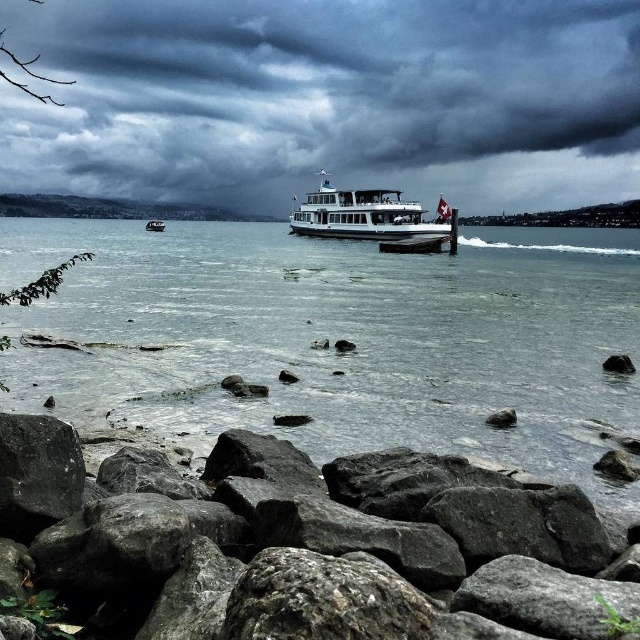
Which is in front, point (51, 45) or point (152, 227)?

Point (152, 227) is more forward.

Is dark gray cloudy sky at upper center thinner than wooden boat at center?

In fact, dark gray cloudy sky at upper center might be wider than wooden boat at center.

Which is in front, point (417, 60) or point (161, 221)?

Point (161, 221) is more forward.

In order to click on dark gray cloudy sky at upper center in this screenshot , I will do `click(328, 99)`.

Between gray rock at lower left and wooden boat at center, which one appears on the left side from the viewer's perspective?

wooden boat at center is more to the left.

The image size is (640, 640). Describe the element at coordinates (307, 547) in the screenshot. I see `gray rock at lower left` at that location.

Locate an element on the screen. This screenshot has height=640, width=640. gray rock at lower left is located at coordinates (307, 547).

Between dark gray cloudy sky at upper center and white glossy ferry at center, which one has more height?

With more height is dark gray cloudy sky at upper center.

Can you confirm if dark gray cloudy sky at upper center is wider than white glossy ferry at center?

Yes.

Locate an element on the screen. The width and height of the screenshot is (640, 640). dark gray cloudy sky at upper center is located at coordinates (328, 99).

What are the coordinates of `dark gray cloudy sky at upper center` in the screenshot? It's located at (328, 99).